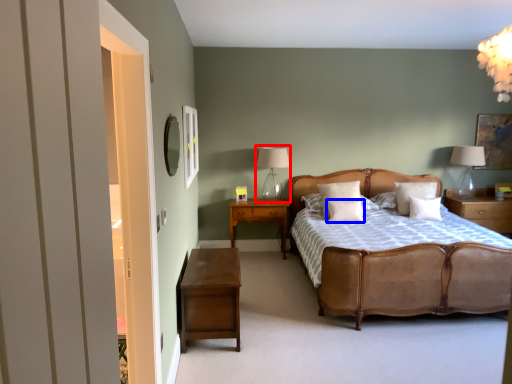
Question: Which of the following is the closest to the observer, table lamp (highlighted by a red box) or pillow (highlighted by a blue box)?

Choices:
 (A) table lamp
 (B) pillow

Answer: (B)